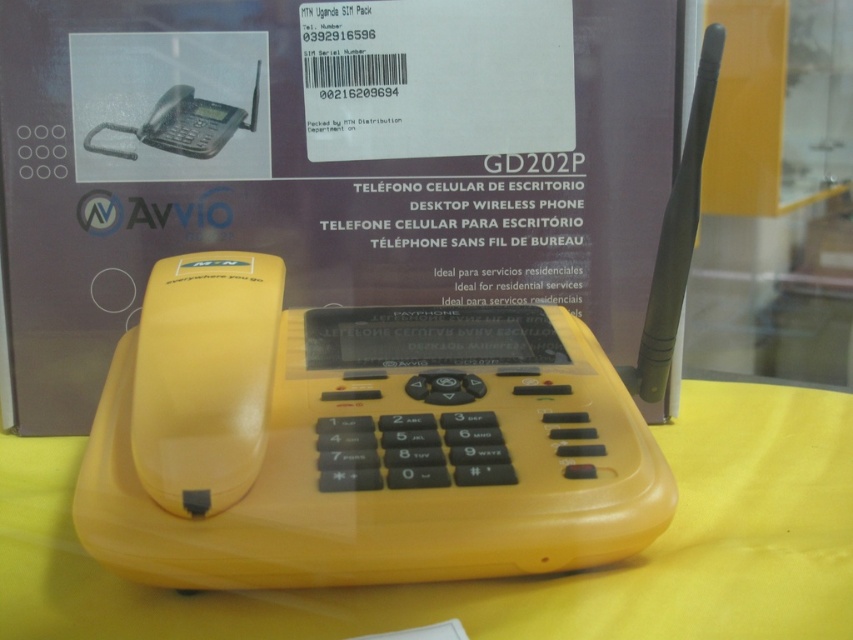
Does yellow plastic phone at center have a greater width compared to matte black phone at upper left?

Correct, the width of yellow plastic phone at center exceeds that of matte black phone at upper left.

Can you confirm if yellow plastic phone at center is bigger than matte black phone at upper left?

Yes, yellow plastic phone at center is bigger than matte black phone at upper left.

Measure the distance between point [642,609] and camera.

58.87 centimeters

The height and width of the screenshot is (640, 853). I want to click on yellow plastic phone at center, so click(514, 577).